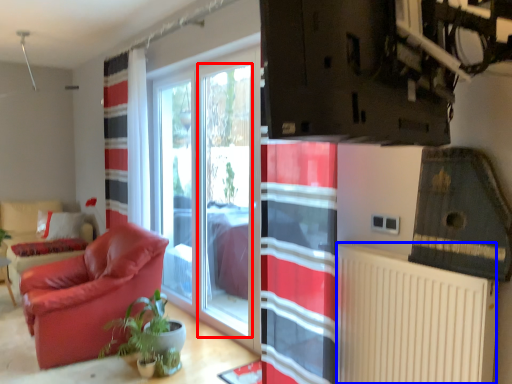
Question: Which object is closer to the camera taking this photo, window screen (highlighted by a red box) or radiator (highlighted by a blue box)?

Choices:
 (A) window screen
 (B) radiator

Answer: (B)